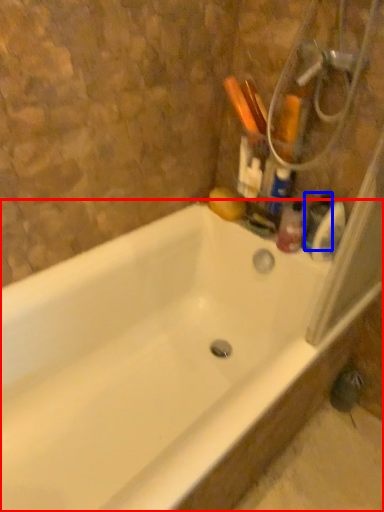
Question: Which of the following is the closest to the observer, bathtub (highlighted by a red box) or toiletry (highlighted by a blue box)?

Choices:
 (A) bathtub
 (B) toiletry

Answer: (A)